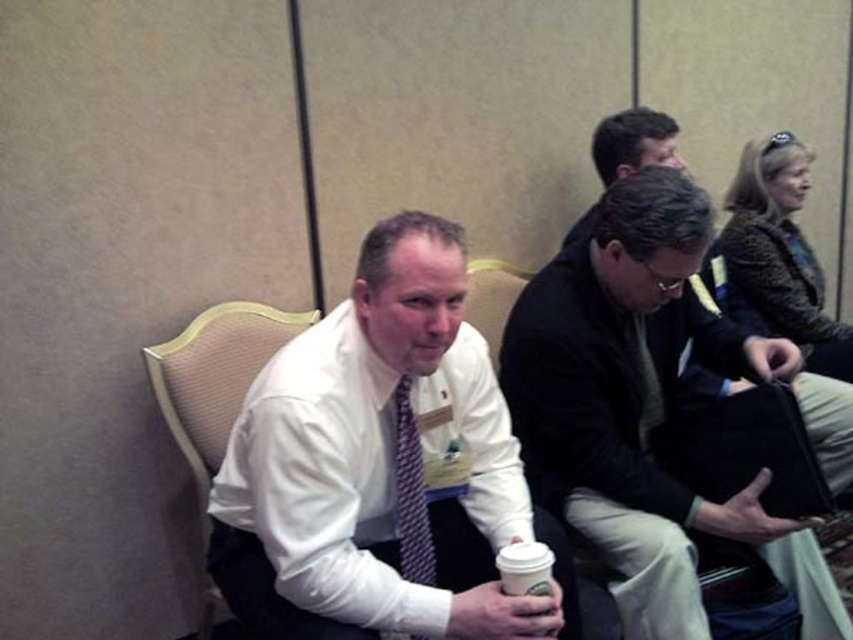
You are organizing a photo shoot in the conference room and need to ensure that the white shirt at center and the beige fabric chair at left fit within a 2.5 meter wide backdrop. Given their sizes, will both objects fit side by side without overlapping?

The white shirt at center is wider than the beige fabric chair at left. However, since the total width of both objects combined would still likely be less than 2.5 meters, they can fit side by side without overlapping.

You are organizing a photo shoot in the conference room. You need to ensure that all objects are visible in the frame. Given that the white shirt at center and the beige fabric chair at left are in the scene, which object should you focus on to ensure both are in focus?

The white shirt at center has a larger size compared to the beige fabric chair at left, so focusing on the larger object, the white shirt at center, will help ensure both are in focus.